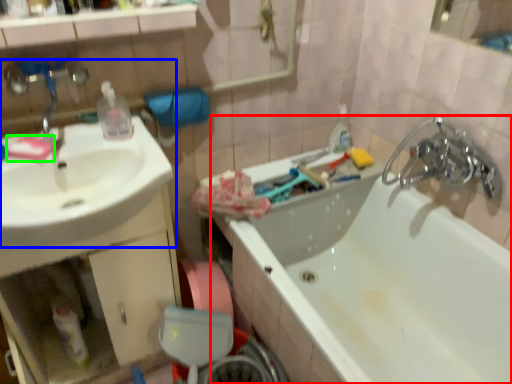
Question: Which is farther away from bathtub (highlighted by a red box)? sink (highlighted by a blue box) or soap (highlighted by a green box)?

Choices:
 (A) sink
 (B) soap

Answer: (B)